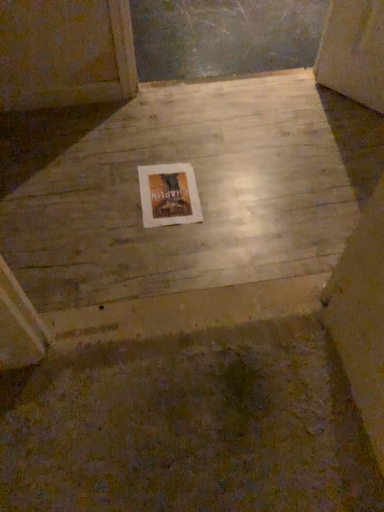
Question: Is white paper at center a part of smooth concrete floor at center?

Choices:
 (A) no
 (B) yes

Answer: (B)

Question: From the image's perspective, is smooth concrete floor at center above white paper at center?

Choices:
 (A) no
 (B) yes

Answer: (B)

Question: Does smooth concrete floor at center have a larger size compared to white paper at center?

Choices:
 (A) yes
 (B) no

Answer: (A)

Question: From the image's perspective, is smooth concrete floor at center located beneath white paper at center?

Choices:
 (A) no
 (B) yes

Answer: (A)

Question: Is smooth concrete floor at center thinner than white paper at center?

Choices:
 (A) yes
 (B) no

Answer: (B)

Question: Is smooth concrete floor at center further to the viewer compared to white paper at center?

Choices:
 (A) no
 (B) yes

Answer: (A)

Question: Is white paper at center aimed at smooth concrete floor at center?

Choices:
 (A) yes
 (B) no

Answer: (A)

Question: Can you confirm if white paper at center is smaller than smooth concrete floor at center?

Choices:
 (A) yes
 (B) no

Answer: (A)

Question: Considering the relative sizes of white paper at center and smooth concrete floor at center in the image provided, is white paper at center taller than smooth concrete floor at center?

Choices:
 (A) yes
 (B) no

Answer: (B)

Question: From the image's perspective, is white paper at center located above smooth concrete floor at center?

Choices:
 (A) yes
 (B) no

Answer: (B)

Question: Is white paper at center oriented away from smooth concrete floor at center?

Choices:
 (A) yes
 (B) no

Answer: (A)

Question: Would you say white paper at center is a long distance from smooth concrete floor at center?

Choices:
 (A) yes
 (B) no

Answer: (B)

Question: Is smooth concrete floor at center in front of or behind white paper at center in the image?

Choices:
 (A) front
 (B) behind

Answer: (A)